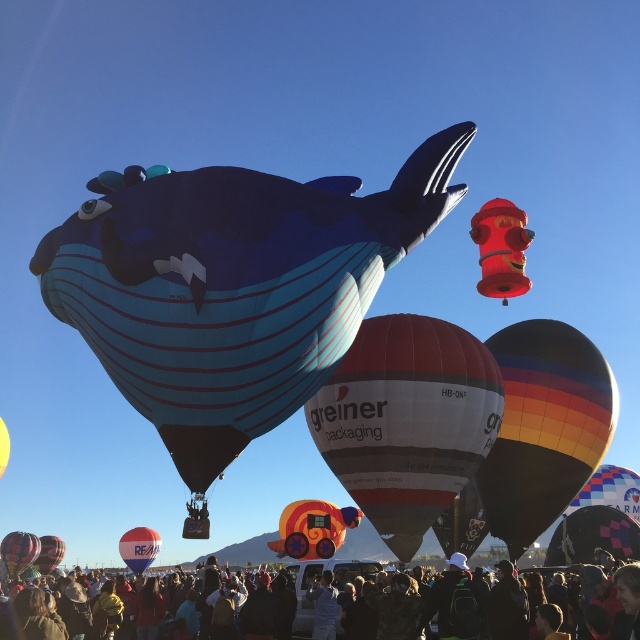
In the scene shown: You are standing at the base of the rainbow striped balloon at center, and you want to take a photo of it with your camera. The camera is 84.04 meters away from the balloon. If your camera has a maximum zoom range of 100 meters, can you capture the entire balloon in the photo?

The rainbow striped balloon at center and the camera are 84.04 meters apart from each other. Since the camera has a maximum zoom range of 100 meters, you can capture the entire balloon in the photo as the distance is within the zoom capability.

You are a photographer at the hot air balloon festival. You want to take a photo that includes both the matte black hot air balloon at lower left and the orange fabric balloon at center. Which balloon should you focus on to ensure both are in the frame without needing to adjust your camera angle?

You should focus on the orange fabric balloon at center because it is taller than the matte black hot air balloon at lower left, allowing both to fit within the frame when centered on the taller one.

You are standing in the hot air balloon festival and see the white glossy hot air balloon at center and the dark blue fabric crowd at lower center. Which object is nearer to you?

The white glossy hot air balloon at center is closer to the viewer than the dark blue fabric crowd at lower center.